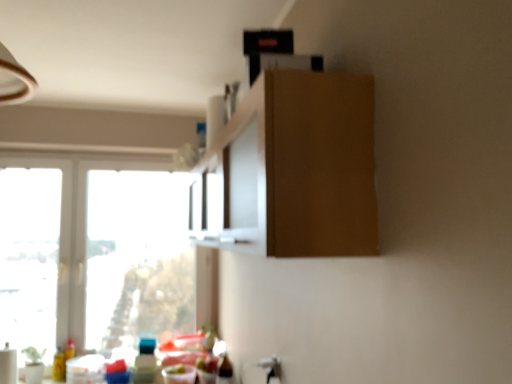
Describe the element at coordinates (145, 362) in the screenshot. I see `translucent plastic bottle at lower left` at that location.

This screenshot has height=384, width=512. In order to click on white glossy window at lower left in this screenshot , I will do `click(93, 253)`.

Who is shorter, translucent plastic bottle at lower left or matte wood cabinet at upper center?

With less height is translucent plastic bottle at lower left.

Which point is more distant from viewer, (136, 360) or (270, 164)?

Positioned behind is point (136, 360).

Is translucent plastic bottle at lower left not close to matte wood cabinet at upper center?

translucent plastic bottle at lower left is positioned a significant distance from matte wood cabinet at upper center.

Considering the relative positions of translucent plastic bottle at lower left and matte wood cabinet at upper center in the image provided, is translucent plastic bottle at lower left in front of matte wood cabinet at upper center?

No, the depth of translucent plastic bottle at lower left is greater than that of matte wood cabinet at upper center.

Does translucent plastic bottle at lower left have a greater width compared to white glossy window at lower left?

Yes, translucent plastic bottle at lower left is wider than white glossy window at lower left.

Which object is further away from the camera, translucent plastic bottle at lower left or white glossy window at lower left?

white glossy window at lower left is behind.

Considering the sizes of objects translucent plastic bottle at lower left and white glossy window at lower left in the image provided, who is smaller, translucent plastic bottle at lower left or white glossy window at lower left?

translucent plastic bottle at lower left.

Is translucent plastic bottle at lower left facing away from white glossy window at lower left?

Correct, translucent plastic bottle at lower left is looking away from white glossy window at lower left.

From their relative heights in the image, would you say matte wood cabinet at upper center is taller or shorter than white glossy window at lower left?

In the image, matte wood cabinet at upper center appears to be shorter than white glossy window at lower left.

The width and height of the screenshot is (512, 384). Identify the location of cabinetry on the right of white glossy window at lower left. (311, 162).

Considering the positions of objects matte wood cabinet at upper center and white glossy window at lower left in the image provided, who is more to the left, matte wood cabinet at upper center or white glossy window at lower left?

From the viewer's perspective, white glossy window at lower left appears more on the left side.

From the picture: Does matte wood cabinet at upper center have a smaller size compared to white glossy window at lower left?

No.

Would you say white glossy window at lower left is inside or outside translucent plastic bottle at lower left?

white glossy window at lower left lies outside translucent plastic bottle at lower left.

Is white glossy window at lower left turned away from translucent plastic bottle at lower left?

Yes, white glossy window at lower left's orientation is away from translucent plastic bottle at lower left.

In terms of size, does white glossy window at lower left appear bigger or smaller than translucent plastic bottle at lower left?

white glossy window at lower left is bigger than translucent plastic bottle at lower left.

Which is more to the left, white glossy window at lower left or translucent plastic bottle at lower left?

white glossy window at lower left.

Is white glossy window at lower left located outside matte wood cabinet at upper center?

Yes.

From a real-world perspective, is white glossy window at lower left over matte wood cabinet at upper center?

No.

Is white glossy window at lower left bigger than matte wood cabinet at upper center?

No.

Does matte wood cabinet at upper center have a greater height compared to translucent plastic bottle at lower left?

Indeed, matte wood cabinet at upper center has a greater height compared to translucent plastic bottle at lower left.

Between matte wood cabinet at upper center and translucent plastic bottle at lower left, which one has larger size?

With larger size is matte wood cabinet at upper center.

From the image's perspective, between matte wood cabinet at upper center and translucent plastic bottle at lower left, who is located below?

translucent plastic bottle at lower left appears lower in the image.

Is matte wood cabinet at upper center far away from translucent plastic bottle at lower left?

Indeed, matte wood cabinet at upper center is not near translucent plastic bottle at lower left.

In the image, there is a translucent plastic bottle at lower left. Where is `cabinetry above it (from the image's perspective)`? cabinetry above it (from the image's perspective) is located at coordinates (311, 162).

This screenshot has height=384, width=512. I want to click on bottle in front of the white glossy window at lower left, so click(145, 362).

Based on their spatial positions, is translucent plastic bottle at lower left or matte wood cabinet at upper center closer to white glossy window at lower left?

translucent plastic bottle at lower left.

Looking at the image, which one is located closer to translucent plastic bottle at lower left, white glossy window at lower left or matte wood cabinet at upper center?

white glossy window at lower left is positioned closer to the anchor translucent plastic bottle at lower left.

Looking at the image, which one is located closer to matte wood cabinet at upper center, translucent plastic bottle at lower left or white glossy window at lower left?

translucent plastic bottle at lower left is positioned closer to the anchor matte wood cabinet at upper center.

Based on their spatial positions, is matte wood cabinet at upper center or translucent plastic bottle at lower left closer to white glossy window at lower left?

Based on the image, translucent plastic bottle at lower left appears to be nearer to white glossy window at lower left.

From the image, which object appears to be farther from translucent plastic bottle at lower left, matte wood cabinet at upper center or white glossy window at lower left?

matte wood cabinet at upper center is further to translucent plastic bottle at lower left.

Considering their positions, is white glossy window at lower left positioned closer to matte wood cabinet at upper center than translucent plastic bottle at lower left?

The object closer to matte wood cabinet at upper center is translucent plastic bottle at lower left.

Identify the location of bottle between matte wood cabinet at upper center and white glossy window at lower left along the z-axis. (145, 362).